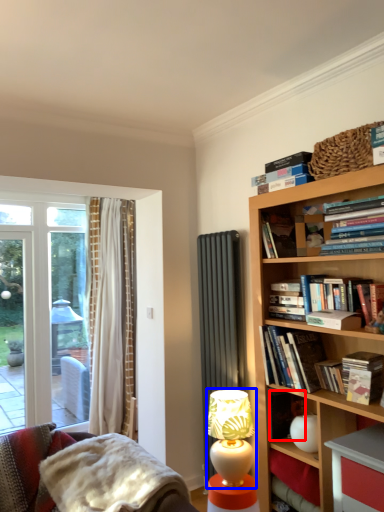
Question: Which of the following is the closest to the observer, paperback book (highlighted by a red box) or table lamp (highlighted by a blue box)?

Choices:
 (A) paperback book
 (B) table lamp

Answer: (A)